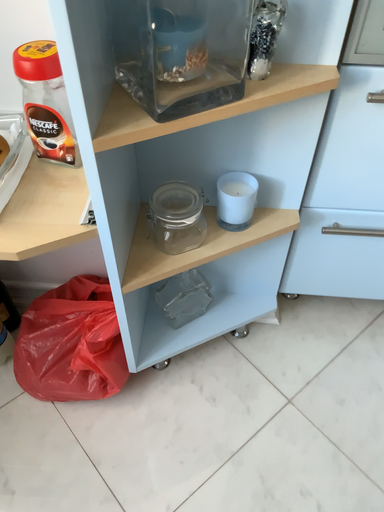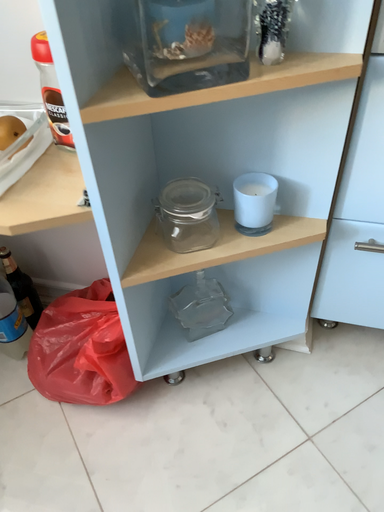
Question: Which way did the camera rotate in the video?

Choices:
 (A) rotated right
 (B) rotated left

Answer: (B)